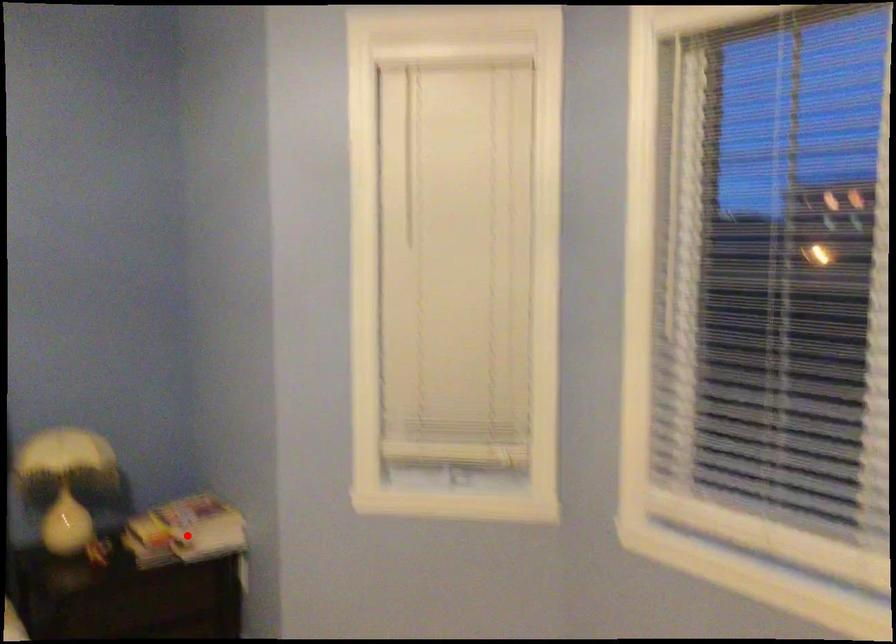
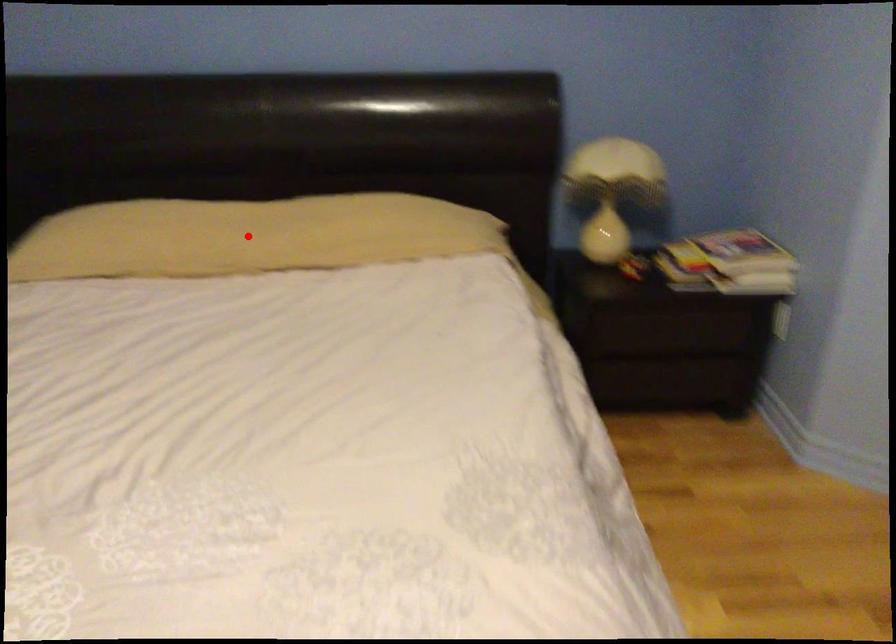
I am providing you with two images of the same scene from different viewpoints. A red point is marked on the first image and another point is marked on the second image. Is the marked point in image1 the same physical position as the marked point in image2?

No